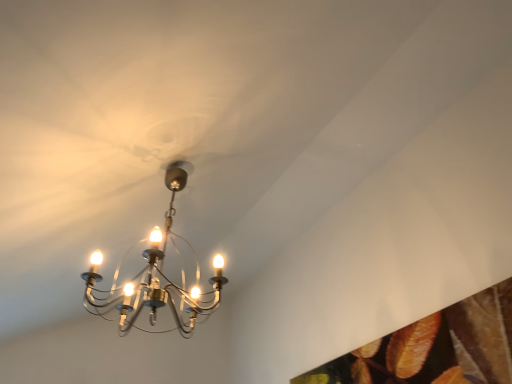
Find the location of a particular element. Image resolution: width=512 pixels, height=384 pixels. metallic chandelier at upper center is located at coordinates (156, 276).

What do you see at coordinates (156, 276) in the screenshot?
I see `metallic chandelier at upper center` at bounding box center [156, 276].

Find the location of a particular element. This screenshot has height=384, width=512. metallic chandelier at upper center is located at coordinates (156, 276).